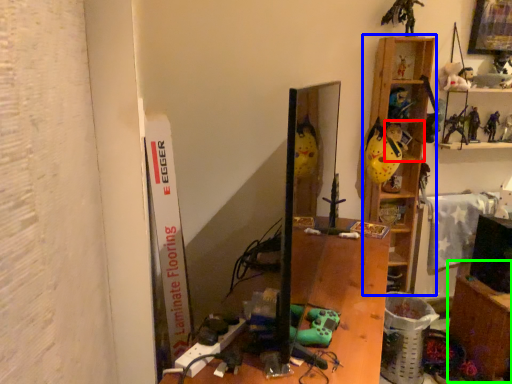
Question: Estimate the real-world distances between objects in this image. Which object is closer to shelf (highlighted by a red box), shelf (highlighted by a blue box) or table (highlighted by a green box)?

Choices:
 (A) shelf
 (B) table

Answer: (A)